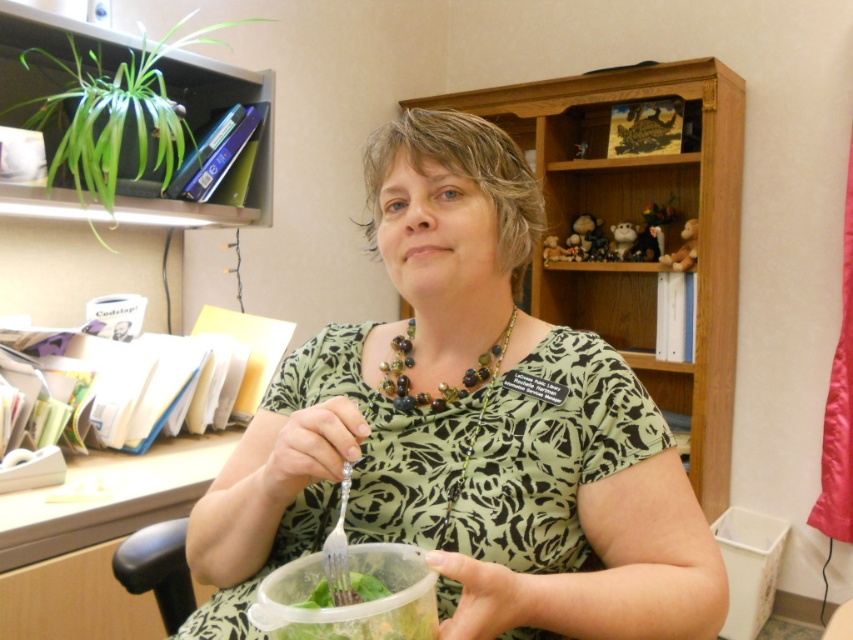
In the scene shown: Who is higher up, green floral shirt at center or multicolored beaded necklace at center?

green floral shirt at center is above.

Does green floral shirt at center have a smaller size compared to multicolored beaded necklace at center?

Incorrect, green floral shirt at center is not smaller in size than multicolored beaded necklace at center.

Who is more distant from viewer, (200, 502) or (471, 369)?

The point (200, 502) is behind.

This screenshot has width=853, height=640. In order to click on green floral shirt at center in this screenshot , I will do `click(465, 429)`.

Who is lower down, green floral shirt at center or transparent plastic bowl at lower center?

Positioned lower is transparent plastic bowl at lower center.

Is green floral shirt at center to the right of transparent plastic bowl at lower center from the viewer's perspective?

In fact, green floral shirt at center is to the left of transparent plastic bowl at lower center.

Which is in front, point (358, 332) or point (338, 609)?

Point (338, 609) is more forward.

Identify the location of green floral shirt at center. This screenshot has height=640, width=853. (465, 429).

Between wooden desk at left and transparent plastic bowl at lower center, which one has more height?

Standing taller between the two is wooden desk at left.

This screenshot has width=853, height=640. Find the location of `wooden desk at left`. wooden desk at left is located at coordinates (96, 541).